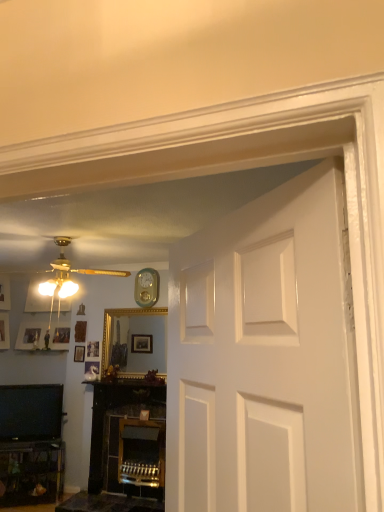
In order to click on matte gold ceiling fan at upper left in this screenshot , I will do click(x=59, y=286).

Identify the location of matte gold ceiling fan at upper left. (59, 286).

Consider the image. What's the angular difference between matte gold ceiling fan at upper left and black glossy television at lower left's facing directions?

31.1 degrees.

Looking at this image, are matte gold ceiling fan at upper left and black glossy television at lower left making contact?

There is a gap between matte gold ceiling fan at upper left and black glossy television at lower left.

Looking at the image, does matte gold ceiling fan at upper left seem bigger or smaller compared to black glossy television at lower left?

Clearly, matte gold ceiling fan at upper left is smaller in size than black glossy television at lower left.

Consider the image. From the image's perspective, is matte gold ceiling fan at upper left above black glossy television at lower left?

Yes, from the image's perspective, matte gold ceiling fan at upper left is over black glossy television at lower left.

Which is less distant, (40, 293) or (70, 294)?

Point (40, 293) is positioned closer to the camera compared to point (70, 294).

Could you tell me if gold metallic ceiling fan at upper left is facing matte gold ceiling fan at upper left?

No, gold metallic ceiling fan at upper left is not aimed at matte gold ceiling fan at upper left.

Who is more distant, gold metallic ceiling fan at upper left or matte gold ceiling fan at upper left?

matte gold ceiling fan at upper left is behind.

Which of these two, gold metallic ceiling fan at upper left or matte gold ceiling fan at upper left, is wider?

Wider between the two is gold metallic ceiling fan at upper left.

Do you think gold metallic ceiling fan at upper left is within wooden picture frame at center, or outside of it?

The correct answer is: outside.

Is gold metallic ceiling fan at upper left with wooden picture frame at center?

No, gold metallic ceiling fan at upper left is not in contact with wooden picture frame at center.

Considering the relative positions of gold metallic ceiling fan at upper left and wooden picture frame at center in the image provided, is gold metallic ceiling fan at upper left to the right of wooden picture frame at center from the viewer's perspective?

Indeed, gold metallic ceiling fan at upper left is positioned on the right side of wooden picture frame at center.

How much distance is there between gold metallic ceiling fan at upper left and wooden picture frame at center?

gold metallic ceiling fan at upper left is 38.34 inches from wooden picture frame at center.

Considering their positions, is black glossy television at lower left located in front of or behind matte gold ceiling fan at upper left?

black glossy television at lower left is positioned farther from the viewer than matte gold ceiling fan at upper left.

From the image's perspective, is black glossy television at lower left over matte gold ceiling fan at upper left?

Actually, black glossy television at lower left appears below matte gold ceiling fan at upper left in the image.

Is black glossy television at lower left facing towards matte gold ceiling fan at upper left?

No, black glossy television at lower left is not facing towards matte gold ceiling fan at upper left.

Based on the photo, which is closer to the camera, (83, 351) or (148, 286)?

Point (83, 351) appears to be farther away from the viewer than point (148, 286).

Is wooden picture frame at center next to teal glossy clock at upper center?

No, wooden picture frame at center is not next to teal glossy clock at upper center.

Is matte gold ceiling fan at upper left with teal glossy clock at upper center?

No, matte gold ceiling fan at upper left is not beside teal glossy clock at upper center.

Does matte gold ceiling fan at upper left have a larger size compared to teal glossy clock at upper center?

Yes, matte gold ceiling fan at upper left is bigger than teal glossy clock at upper center.

Is matte gold ceiling fan at upper left in front of teal glossy clock at upper center?

Yes, matte gold ceiling fan at upper left is closer to the viewer.

Which is in front, point (60, 285) or point (137, 291)?

Point (60, 285)

Is black glossy television at lower left positioned beyond the bounds of wooden picture frame at center?

Yes.

Looking at this image, is black glossy television at lower left taller than wooden picture frame at center?

Yes.

Is black glossy television at lower left oriented towards wooden picture frame at center?

No, black glossy television at lower left is not facing towards wooden picture frame at center.

The width and height of the screenshot is (384, 512). I want to click on lamp above the black glossy television at lower left (from a real-world perspective), so click(x=59, y=286).

Identify the location of lamp below the gold metallic ceiling fan at upper left (from a real-world perspective). The width and height of the screenshot is (384, 512). (59, 286).

Based on their spatial positions, is gold metallic ceiling fan at upper left or matte gold ceiling fan at upper left closer to teal glossy clock at upper center?

Based on the image, gold metallic ceiling fan at upper left appears to be nearer to teal glossy clock at upper center.

Looking at the image, which one is located further to matte gold ceiling fan at upper left, wooden picture frame at center or gold metallic ceiling fan at upper left?

Based on the image, wooden picture frame at center appears to be further to matte gold ceiling fan at upper left.

Which object lies further to the anchor point matte gold ceiling fan at upper left, teal glossy clock at upper center or gold metallic ceiling fan at upper left?

Based on the image, teal glossy clock at upper center appears to be further to matte gold ceiling fan at upper left.

From the image, which object appears to be farther from wooden picture frame at center, black glossy television at lower left or matte gold ceiling fan at upper left?

The object further to wooden picture frame at center is matte gold ceiling fan at upper left.

When comparing their distances from teal glossy clock at upper center, does matte gold ceiling fan at upper left or wooden picture frame at center seem closer?

wooden picture frame at center is positioned closer to the anchor teal glossy clock at upper center.

Estimate the real-world distances between objects in this image. Which object is closer to gold metallic ceiling fan at upper left, matte gold ceiling fan at upper left or black glossy television at lower left?

Among the two, matte gold ceiling fan at upper left is located nearer to gold metallic ceiling fan at upper left.

When comparing their distances from black glossy television at lower left, does gold metallic ceiling fan at upper left or wooden picture frame at center seem closer?

wooden picture frame at center is positioned closer to the anchor black glossy television at lower left.

From the picture: Which object lies nearer to the anchor point gold metallic ceiling fan at upper left, matte gold ceiling fan at upper left or wooden picture frame at center?

Based on the image, matte gold ceiling fan at upper left appears to be nearer to gold metallic ceiling fan at upper left.

The height and width of the screenshot is (512, 384). Find the location of `lamp between gold metallic ceiling fan at upper left and black glossy television at lower left in the vertical direction`. lamp between gold metallic ceiling fan at upper left and black glossy television at lower left in the vertical direction is located at coordinates (59, 286).

Find the location of `clock between matte gold ceiling fan at upper left and black glossy television at lower left in the vertical direction`. clock between matte gold ceiling fan at upper left and black glossy television at lower left in the vertical direction is located at coordinates (146, 287).

This screenshot has width=384, height=512. I want to click on lamp located between gold metallic ceiling fan at upper left and wooden picture frame at center in the depth direction, so click(x=59, y=286).

The height and width of the screenshot is (512, 384). Identify the location of clock positioned between matte gold ceiling fan at upper left and wooden picture frame at center from near to far. (x=146, y=287).